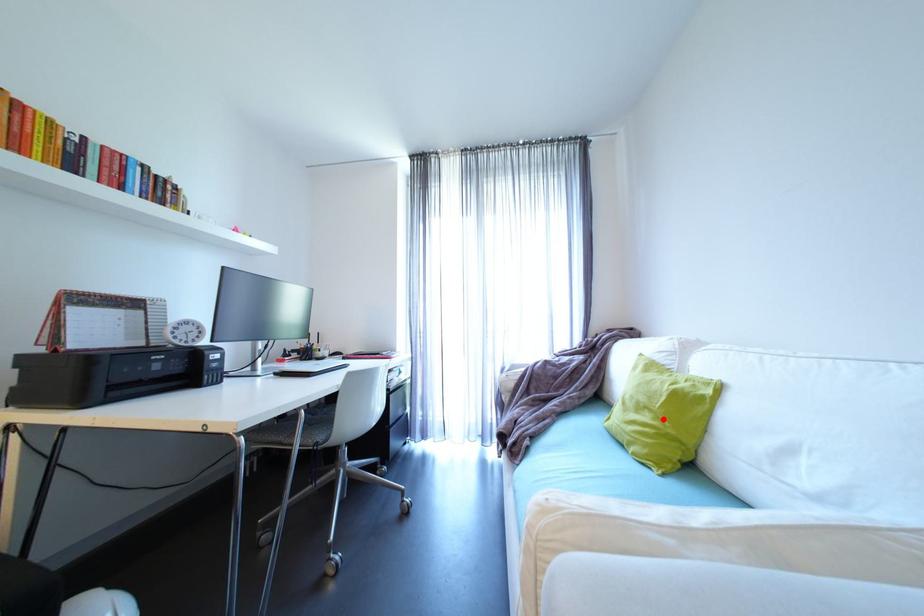
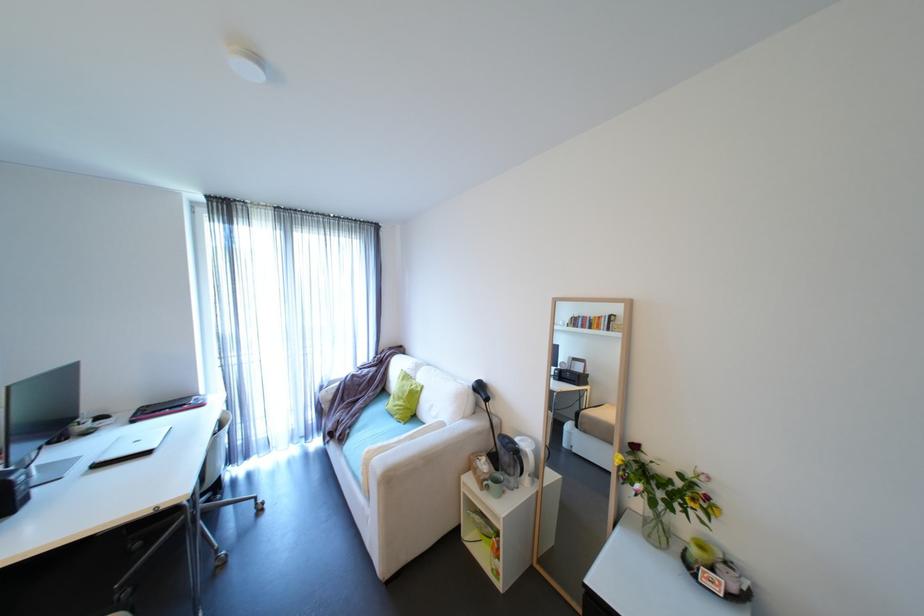
Where in the second image is the point corresponding to the highlighted location from the first image?

(411, 402)